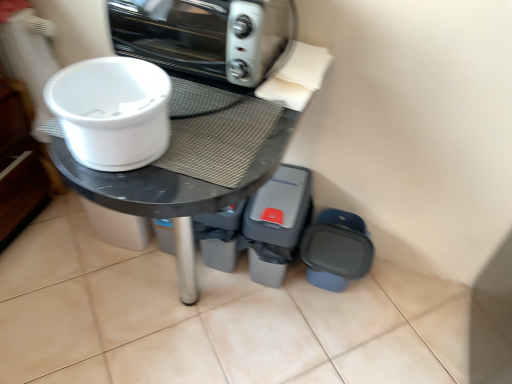
Where is `free space that is in between matte black table at center and gray plastic bin at lower right, the second appliance viewed from the right`? This screenshot has width=512, height=384. free space that is in between matte black table at center and gray plastic bin at lower right, the second appliance viewed from the right is located at coordinates (262, 326).